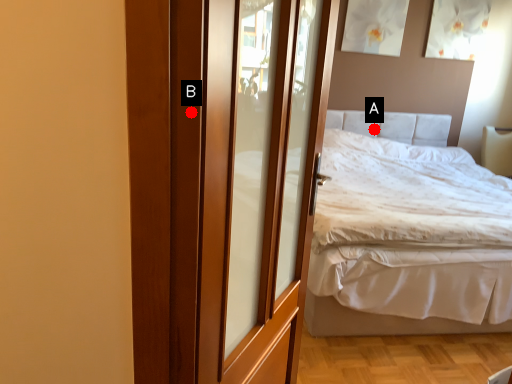
Question: Two points are circled on the image, labeled by A and B beside each circle. Among these points, which one is farthest from the camera?

Choices:
 (A) A is further
 (B) B is further

Answer: (A)